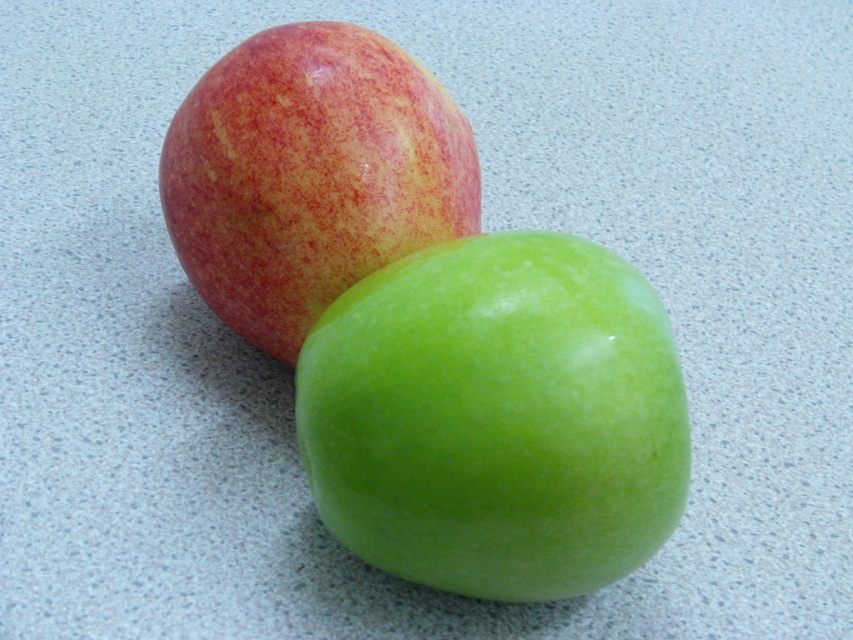
Between green shiny apple at center and matte red apple at upper left, which one is positioned higher?

Positioned higher is matte red apple at upper left.

Who is taller, green shiny apple at center or matte red apple at upper left?

Standing taller between the two is matte red apple at upper left.

Who is more distant from viewer, (636, 396) or (259, 124)?

The point (259, 124) is more distant.

At what (x,y) coordinates should I click in order to perform the action: click on green shiny apple at center. Please return your answer as a coordinate pair (x, y). This screenshot has width=853, height=640. Looking at the image, I should click on (497, 417).